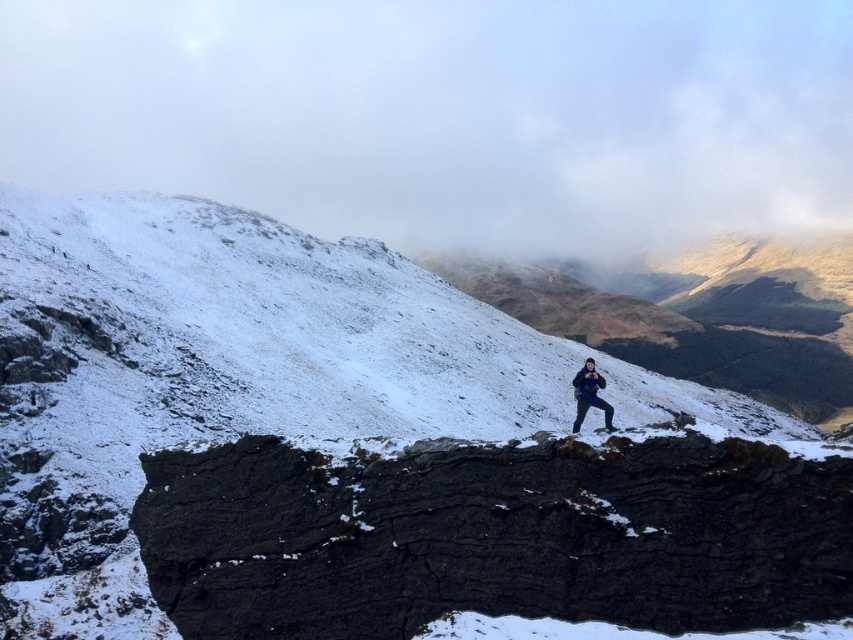
Question: Which object is closer to the camera taking this photo?

Choices:
 (A) dark blue jacket at center
 (B) dark gray rocky cliff at center

Answer: (B)

Question: Which is nearer to the dark blue jacket at center?

Choices:
 (A) dark gray rock formation at center
 (B) dark gray rocky cliff at center

Answer: (B)

Question: Which of the following is the closest to the observer?

Choices:
 (A) dark gray rock formation at center
 (B) dark blue jacket at center

Answer: (A)

Question: Does dark gray rocky cliff at center appear on the left side of dark blue jacket at center?

Choices:
 (A) yes
 (B) no

Answer: (A)

Question: Can you confirm if dark gray rocky cliff at center is wider than dark blue jacket at center?

Choices:
 (A) no
 (B) yes

Answer: (B)

Question: Can you confirm if dark gray rocky cliff at center is positioned above dark blue jacket at center?

Choices:
 (A) yes
 (B) no

Answer: (B)